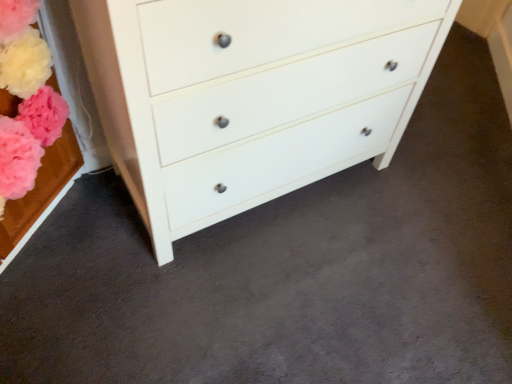
The height and width of the screenshot is (384, 512). Find the location of `white matte chest of drawers at center`. white matte chest of drawers at center is located at coordinates (x=247, y=94).

Describe the element at coordinates (247, 94) in the screenshot. Image resolution: width=512 pixels, height=384 pixels. I see `white matte chest of drawers at center` at that location.

You are a GUI agent. You are given a task and a screenshot of the screen. Output one action in this format:
    pyautogui.click(x=<x>, y=<y>)
    Task: Click on the white matte chest of drawers at center
    This screenshot has height=384, width=512.
    Given the screenshot: What is the action you would take?
    (247, 94)